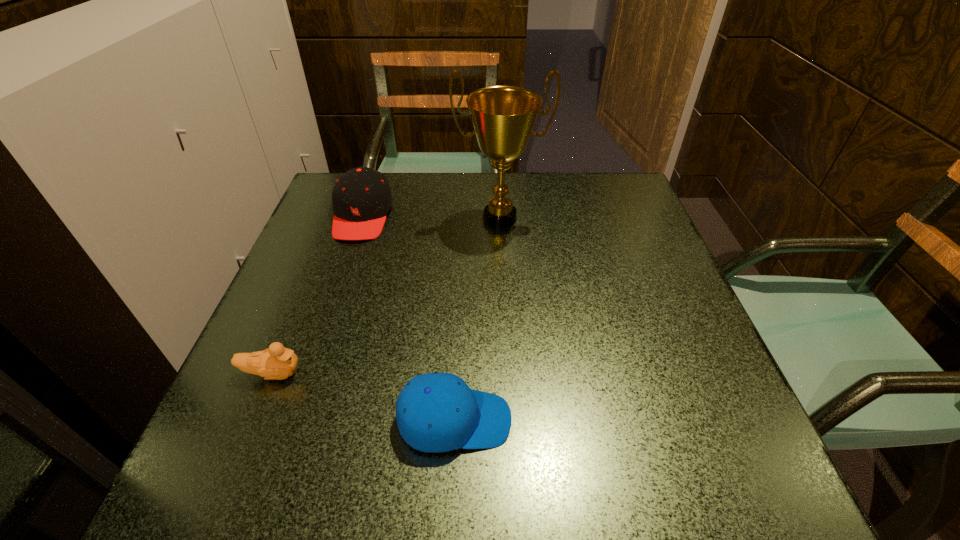
At what (x,y) coordinates should I click in order to perform the action: click on award present at the far edge. Please return your answer as a coordinate pair (x, y). The height and width of the screenshot is (540, 960). Looking at the image, I should click on (503, 117).

This screenshot has width=960, height=540. What are the coordinates of `cap that is at the far edge` in the screenshot? It's located at (361, 197).

You are a GUI agent. You are given a task and a screenshot of the screen. Output one action in this format:
    pyautogui.click(x=<x>, y=<y>)
    Task: Click on the object present at the near edge
    The width and height of the screenshot is (960, 540).
    Given the screenshot: What is the action you would take?
    pyautogui.click(x=436, y=412)

Locate an element on the screen. The height and width of the screenshot is (540, 960). cap present at the left edge is located at coordinates (361, 197).

In order to click on duckling that is positioned at the left edge in this screenshot , I will do `click(276, 363)`.

Identify the location of object situated at the far left corner. (361, 197).

The image size is (960, 540). I want to click on free region at the far edge of the desktop, so point(420,185).

Find the location of a particular element. vacant point at the near edge is located at coordinates (390, 482).

Where is `vacant space at the left edge of the desktop`? vacant space at the left edge of the desktop is located at coordinates (303, 331).

In order to click on vacant area at the right edge of the desktop in this screenshot , I will do `click(696, 372)`.